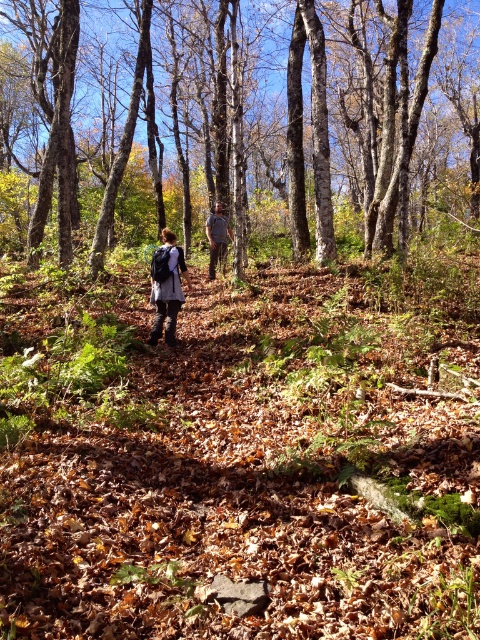
Looking at this image, between matte gray jacket at center and dark brown leather jacket at center, which one appears on the right side from the viewer's perspective?

Positioned to the right is dark brown leather jacket at center.

Does matte gray jacket at center appear over dark brown leather jacket at center?

No.

Find the location of `matte gray jacket at center`. matte gray jacket at center is located at coordinates (167, 288).

Between point (187, 100) and point (173, 269), which one is positioned behind?

The point (187, 100) is behind.

Does point (179, 198) come behind point (186, 275)?

Yes.

Is point (21, 84) positioned in front of point (168, 234)?

No, it is not.

Find the location of `brown smooth tree at center`. brown smooth tree at center is located at coordinates (245, 118).

Based on the photo, measure the distance between brown smooth tree at center and matte gray coat at center.

They are 22.34 meters apart.

Is brown smooth tree at center taller than matte gray coat at center?

Yes, brown smooth tree at center is taller than matte gray coat at center.

Where is `brown smooth tree at center`? brown smooth tree at center is located at coordinates (245, 118).

What are the coordinates of `brown smooth tree at center` in the screenshot? It's located at (245, 118).